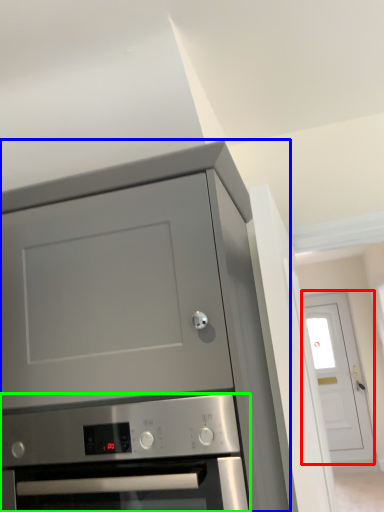
Question: Which object is the closest to the door (highlighted by a red box)? Choose among these: cabinetry (highlighted by a blue box) or oven (highlighted by a green box).

Choices:
 (A) cabinetry
 (B) oven

Answer: (A)